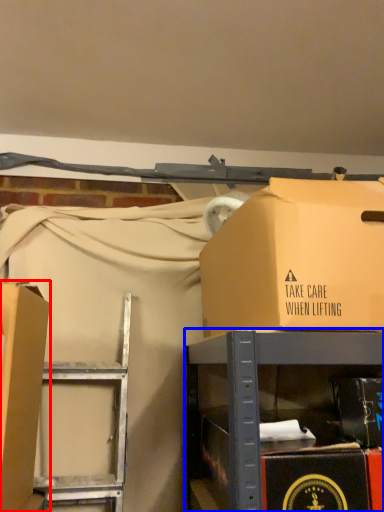
Question: Which object is closer to the camera taking this photo, box (highlighted by a red box) or furniture (highlighted by a blue box)?

Choices:
 (A) box
 (B) furniture

Answer: (B)